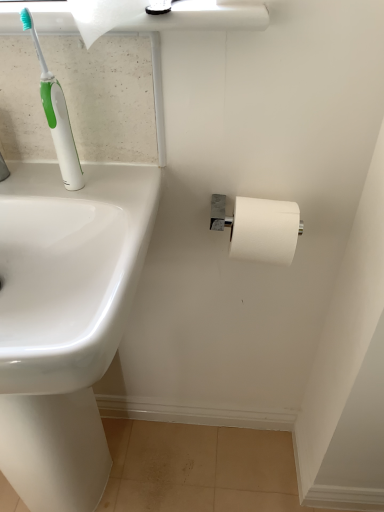
At what (x,y) coordinates should I click in order to perform the action: click on vacant space positioned to the left of green plastic toothbrush at upper left. Please return your answer as a coordinate pair (x, y). The width and height of the screenshot is (384, 512). Looking at the image, I should click on (36, 184).